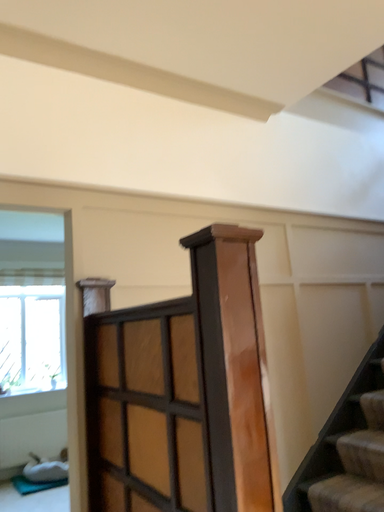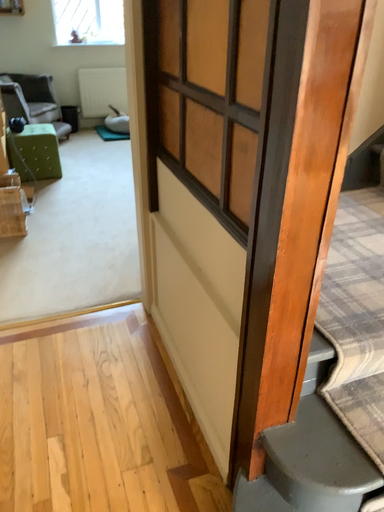
Question: Which way did the camera rotate in the video?

Choices:
 (A) rotated right
 (B) rotated left

Answer: (B)